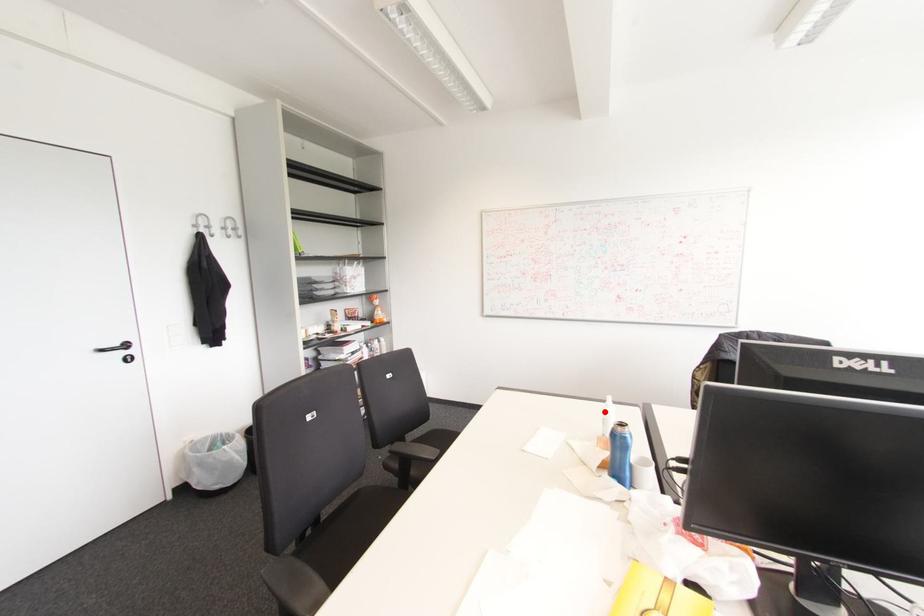
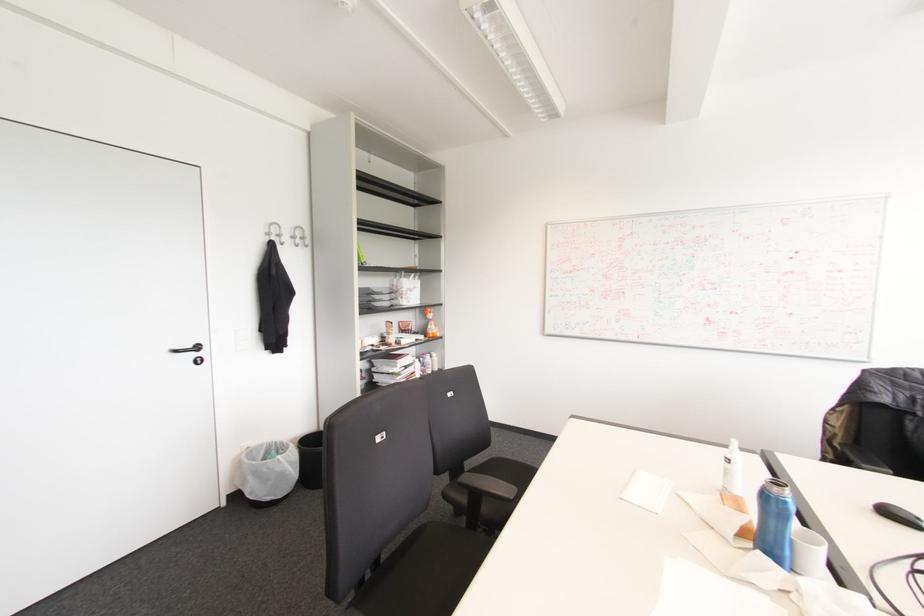
The point at the highlighted location is marked in the first image. Where is the corresponding point in the second image?

(727, 460)